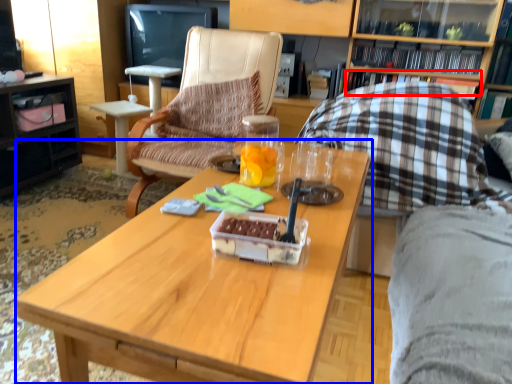
Question: Among these objects, which one is nearest to the camera, book (highlighted by a red box) or coffee table (highlighted by a blue box)?

Choices:
 (A) book
 (B) coffee table

Answer: (B)